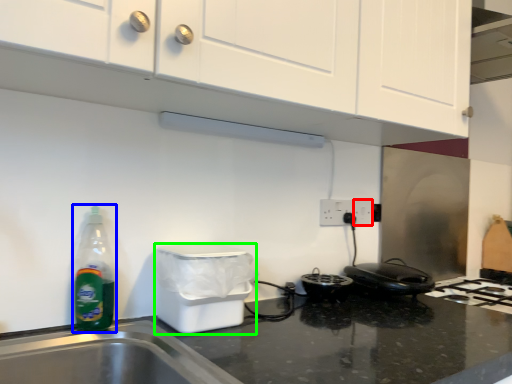
Question: Based on their relative distances, which object is nearer to electric outlet (highlighted by a red box)? Choose from bottle (highlighted by a blue box) and appliance (highlighted by a green box).

Choices:
 (A) bottle
 (B) appliance

Answer: (B)